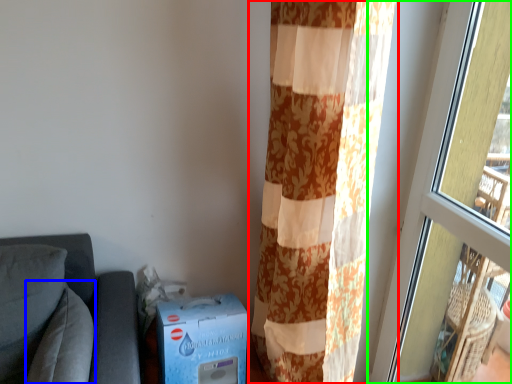
Question: Based on their relative distances, which object is farther from curtain (highlighted by a red box)? Choose from pillow (highlighted by a blue box) and window (highlighted by a green box).

Choices:
 (A) pillow
 (B) window

Answer: (A)